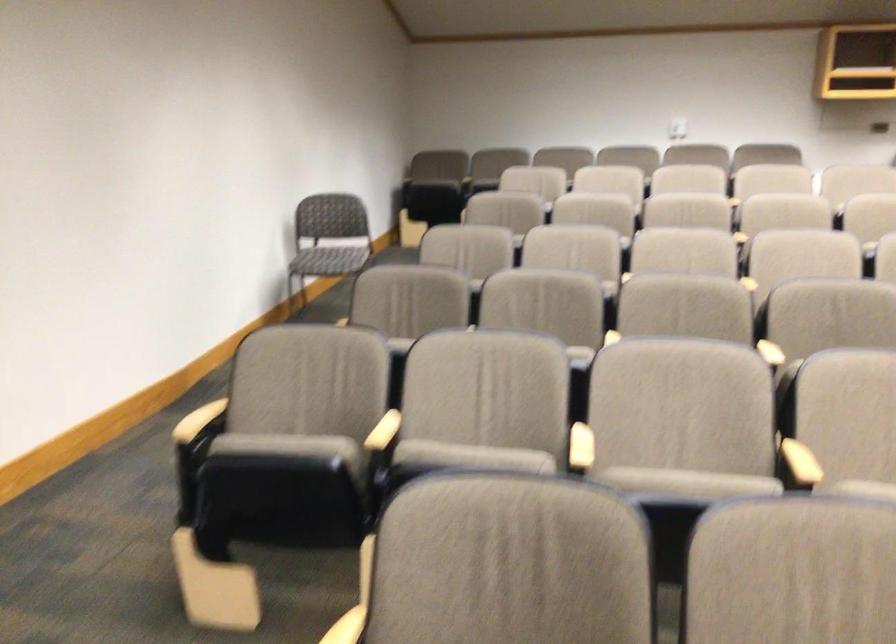
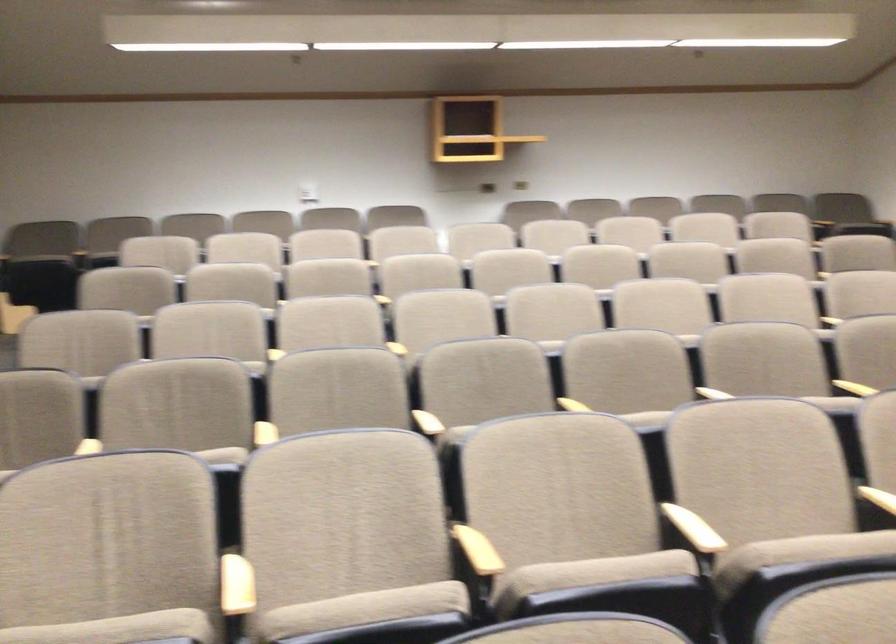
In the second image, find the point that corresponds to [486,458] in the first image.

(117, 629)